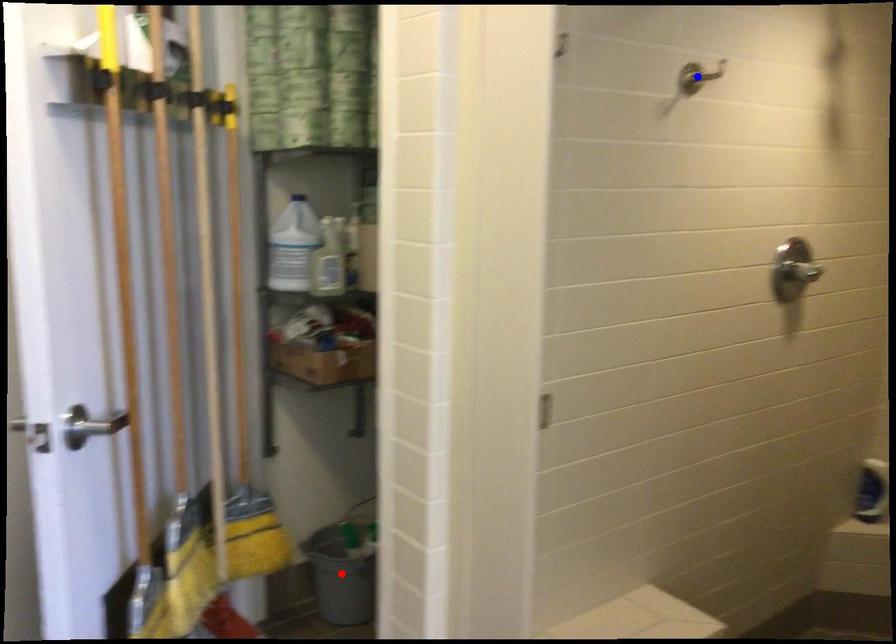
Question: Two points are marked on the image. Which point is closer to the camera?

Choices:
 (A) Blue point is closer.
 (B) Red point is closer.

Answer: (A)